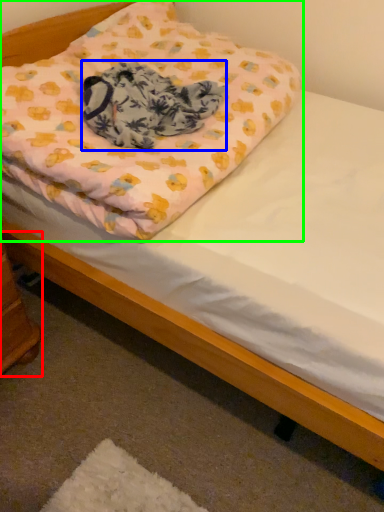
Question: Considering the real-world distances, which object is closest to changing table (highlighted by a red box)? blanket (highlighted by a blue box) or pillow (highlighted by a green box).

Choices:
 (A) blanket
 (B) pillow

Answer: (A)